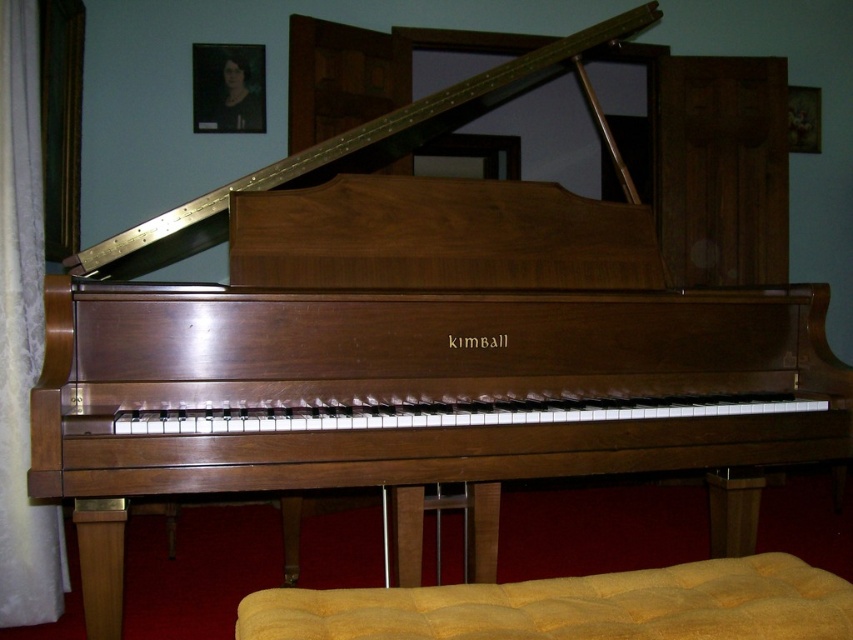
Is point (714, 600) farther from viewer compared to point (41, 280)?

No, (714, 600) is in front of (41, 280).

Who is more distant from viewer, (635, 596) or (28, 525)?

Answer: The point (28, 525) is more distant.

The width and height of the screenshot is (853, 640). Describe the element at coordinates (573, 605) in the screenshot. I see `yellow fabric footrest at lower center` at that location.

In order to click on yellow fabric footrest at lower center in this screenshot , I will do `click(573, 605)`.